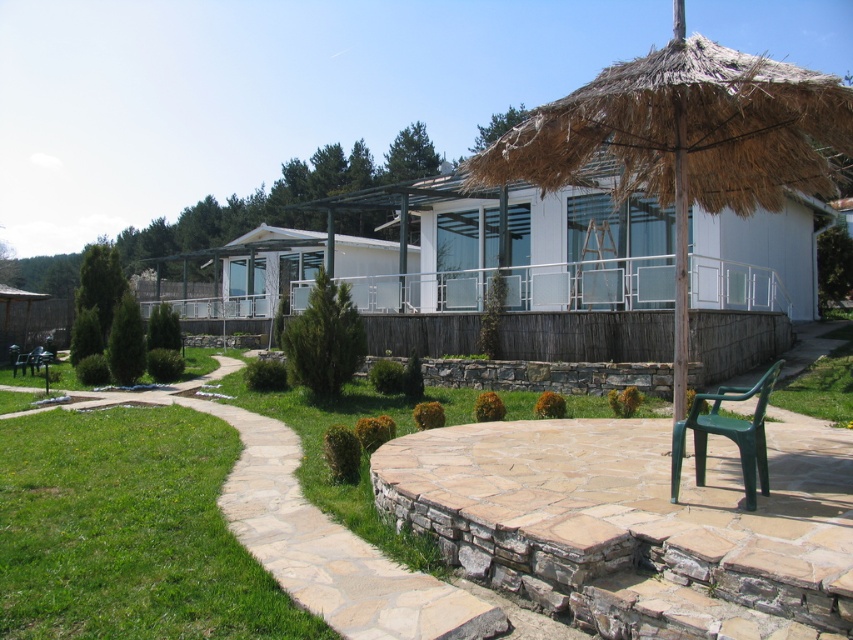
Question: Considering the relative positions of thatched straw umbrella at center and white glass hut at center in the image provided, where is thatched straw umbrella at center located with respect to white glass hut at center?

Choices:
 (A) right
 (B) left

Answer: (A)

Question: Is green plastic chair at center further to the viewer compared to green plastic bench at lower left?

Choices:
 (A) yes
 (B) no

Answer: (B)

Question: Which point is farther to the camera?

Choices:
 (A) (38, 353)
 (B) (659, 236)
 (C) (685, 67)

Answer: (A)

Question: Which object is closer to the camera taking this photo?

Choices:
 (A) green plastic bench at lower left
 (B) thatched straw umbrella at center

Answer: (B)

Question: Does natural stone path at center appear over green plastic bench at lower left?

Choices:
 (A) no
 (B) yes

Answer: (A)

Question: Which object is closer to the camera taking this photo?

Choices:
 (A) green plastic chair at center
 (B) green plastic bench at lower left
 (C) natural stone path at center

Answer: (C)